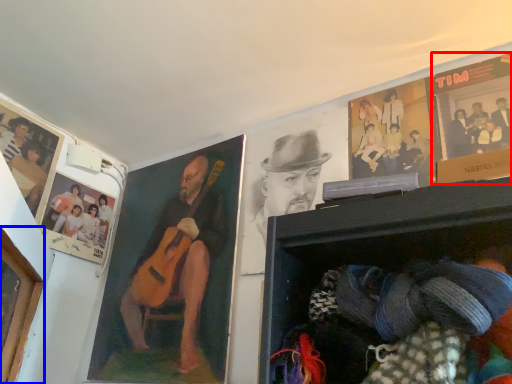
Question: Which point is further to the camera, poster page (highlighted by a red box) or portrait (highlighted by a blue box)?

Choices:
 (A) poster page
 (B) portrait

Answer: (A)